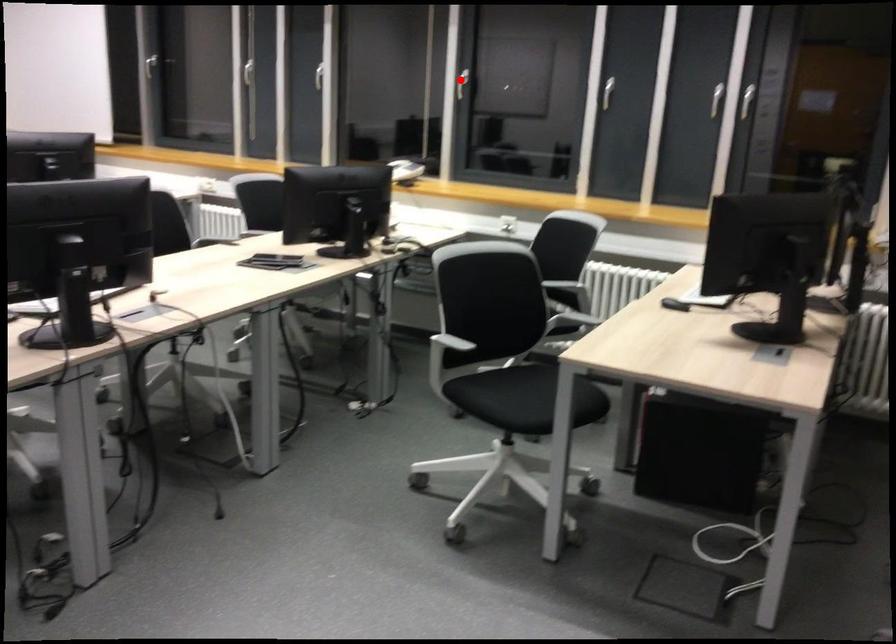
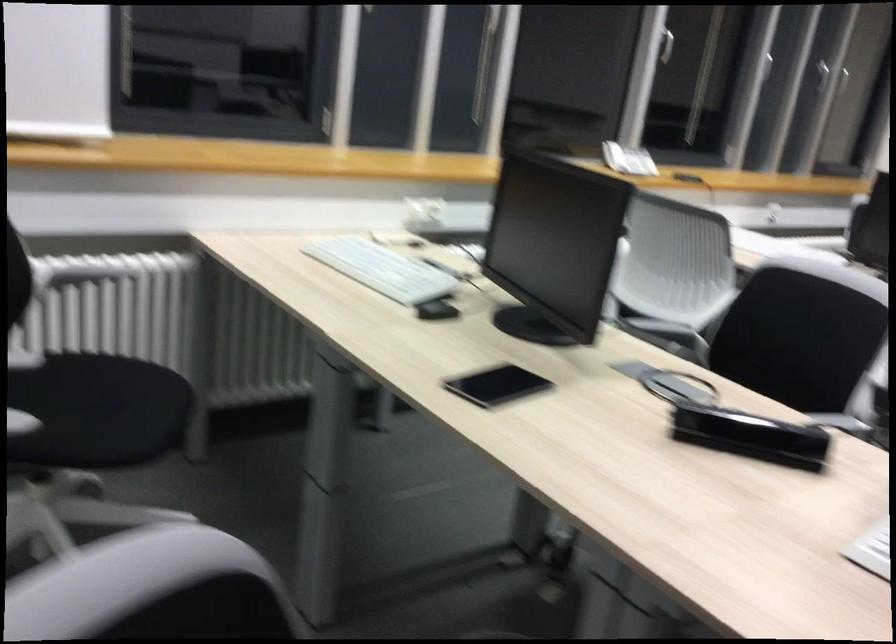
The point at the highlighted location is marked in the first image. Where is the corresponding point in the second image?

(666, 46)